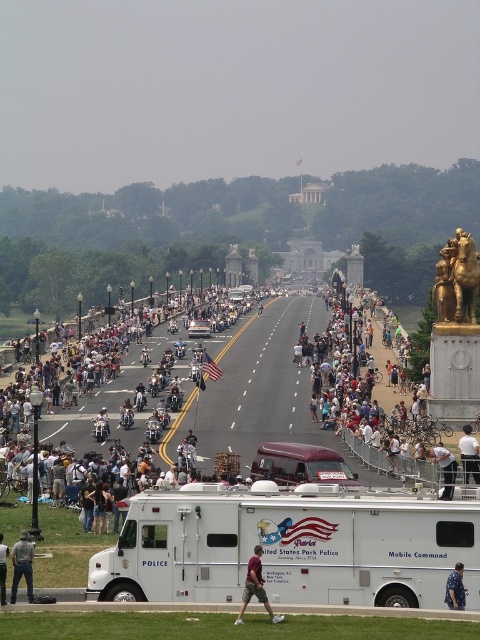
Question: Does gold/golden/statue at right appear on the left side of white cotton shirt at center?

Choices:
 (A) no
 (B) yes

Answer: (A)

Question: Among these objects, which one is farthest from the camera?

Choices:
 (A) brown cotton shorts at center
 (B) light blue shirt at center
 (C) maroon vinyl tour bus at center
 (D) gold/golden/statue at right

Answer: (D)

Question: Is denim jacket at lower left behind white cotton shirt at center?

Choices:
 (A) no
 (B) yes

Answer: (A)

Question: Estimate the real-world distances between objects in this image. Which object is farther from the white cotton shirt at center?

Choices:
 (A) white fabric shirt at lower right
 (B) light blue shirt at center

Answer: (B)

Question: Among these points, which one is nearest to the camera?

Choices:
 (A) (2, 586)
 (B) (436, 268)
 (C) (392, 532)

Answer: (A)

Question: From the image, what is the correct spatial relationship of white fabric shirt at lower right in relation to light blue shirt at center?

Choices:
 (A) left
 (B) right

Answer: (B)